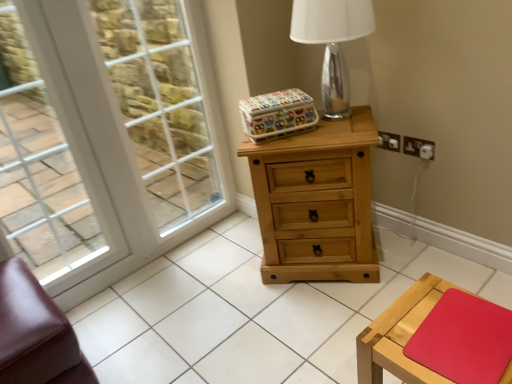
Question: Is natural wood tile at center a part of transparent glass table lamp at upper center?

Choices:
 (A) yes
 (B) no

Answer: (B)

Question: Is transparent glass table lamp at upper center bigger than natural wood tile at center?

Choices:
 (A) yes
 (B) no

Answer: (B)

Question: Is transparent glass table lamp at upper center aimed at natural wood tile at center?

Choices:
 (A) yes
 (B) no

Answer: (B)

Question: Can you confirm if transparent glass table lamp at upper center is smaller than natural wood tile at center?

Choices:
 (A) no
 (B) yes

Answer: (B)

Question: Is transparent glass table lamp at upper center not within natural wood tile at center?

Choices:
 (A) no
 (B) yes

Answer: (B)

Question: Considering their positions, is transparent glass table lamp at upper center located in front of or behind brown leather ottoman at lower left?

Choices:
 (A) front
 (B) behind

Answer: (B)

Question: Considering the positions of transparent glass table lamp at upper center and brown leather ottoman at lower left in the image, is transparent glass table lamp at upper center bigger or smaller than brown leather ottoman at lower left?

Choices:
 (A) big
 (B) small

Answer: (B)

Question: In terms of width, does transparent glass table lamp at upper center look wider or thinner when compared to brown leather ottoman at lower left?

Choices:
 (A) wide
 (B) thin

Answer: (B)

Question: Is transparent glass table lamp at upper center situated inside brown leather ottoman at lower left or outside?

Choices:
 (A) inside
 (B) outside

Answer: (B)

Question: From the image's perspective, relative to white glass window screen at upper left, is natural wood tile at center above or below?

Choices:
 (A) above
 (B) below

Answer: (B)

Question: Considering the positions of point (139, 326) and point (195, 117), is point (139, 326) closer or farther from the camera than point (195, 117)?

Choices:
 (A) farther
 (B) closer

Answer: (B)

Question: Based on their sizes in the image, would you say natural wood tile at center is bigger or smaller than white glass window screen at upper left?

Choices:
 (A) small
 (B) big

Answer: (B)

Question: In terms of height, does natural wood tile at center look taller or shorter compared to white glass window screen at upper left?

Choices:
 (A) short
 (B) tall

Answer: (A)

Question: Looking at their shapes, would you say natural wood chest of drawers at center is wider or thinner than brown leather ottoman at lower left?

Choices:
 (A) wide
 (B) thin

Answer: (B)

Question: From the image's perspective, is natural wood chest of drawers at center located above or below brown leather ottoman at lower left?

Choices:
 (A) above
 (B) below

Answer: (A)